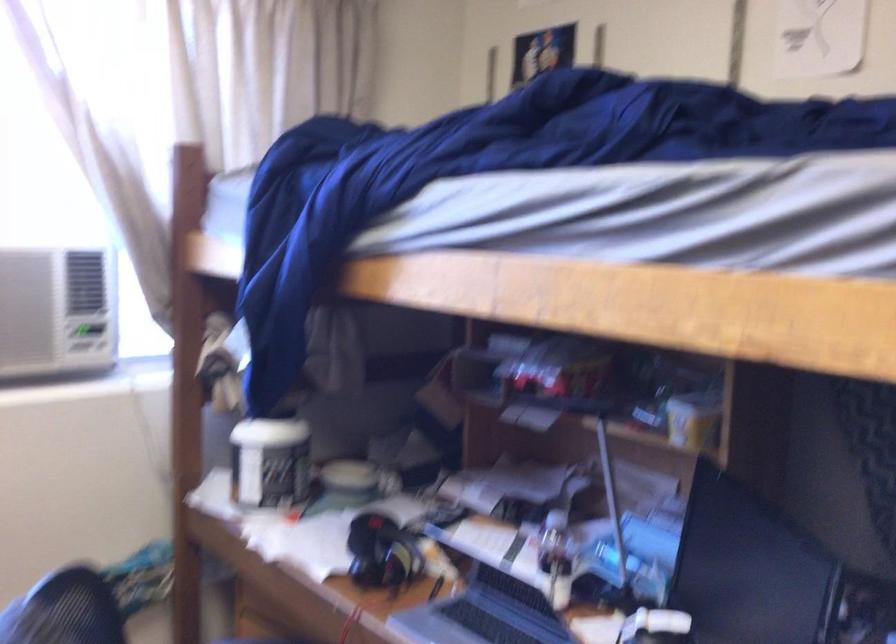
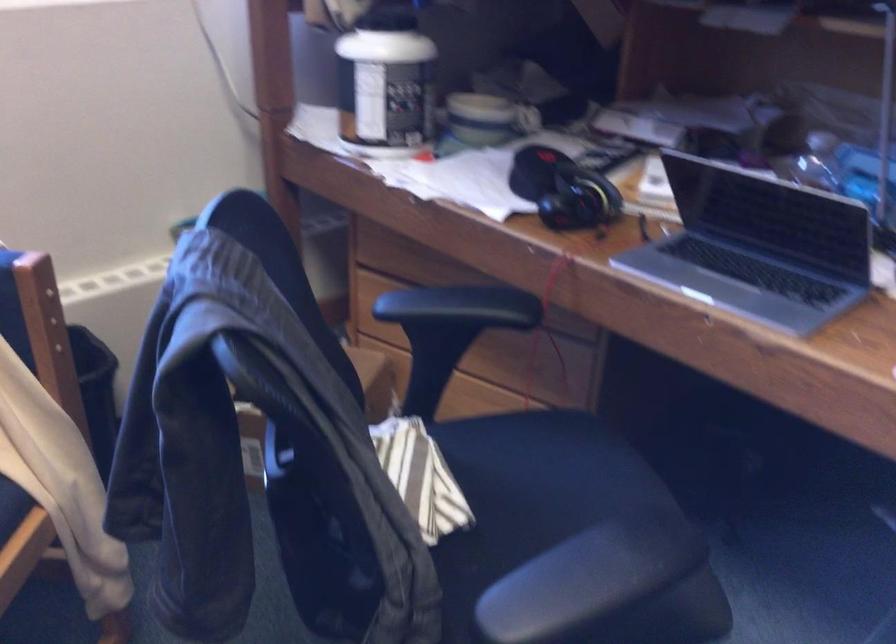
Question: Based on the continuous images, in which direction is the camera rotating? Reply with the corresponding letter.

Choices:
 (A) Left
 (B) Right
 (C) Up
 (D) Down

Answer: (D)